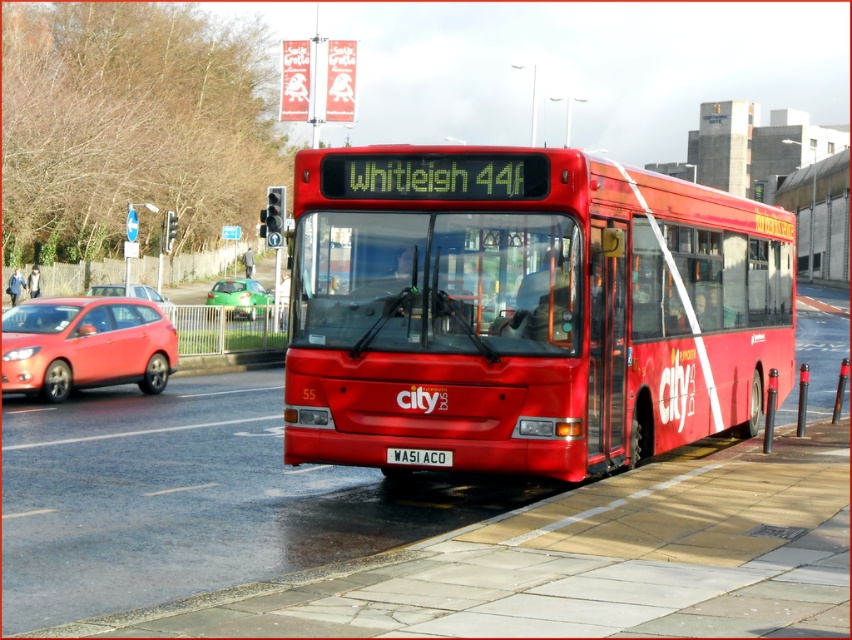
Does shiny red bus at center have a greater height compared to green glossy car at left?

Correct, shiny red bus at center is much taller as green glossy car at left.

Is point (390, 340) behind point (250, 307)?

No, (390, 340) is in front of (250, 307).

This screenshot has width=852, height=640. In order to click on shiny red bus at center in this screenshot , I will do `click(525, 308)`.

Identify the location of matte red hatchback at left. This screenshot has height=640, width=852. (85, 346).

Who is taller, matte red hatchback at left or green glossy car at left?

green glossy car at left is taller.

You are a GUI agent. You are given a task and a screenshot of the screen. Output one action in this format:
    pyautogui.click(x=<x>, y=<y>)
    Task: Click on the matte red hatchback at left
    The height and width of the screenshot is (640, 852).
    Given the screenshot: What is the action you would take?
    pyautogui.click(x=85, y=346)

Who is more forward, (235, 304) or (118, 294)?

Point (118, 294) is more forward.

Is green glossy car at left behind metallic silver hatchback at left?

That is True.

The image size is (852, 640). What do you see at coordinates (240, 298) in the screenshot?
I see `green glossy car at left` at bounding box center [240, 298].

Identify the location of green glossy car at left. (240, 298).